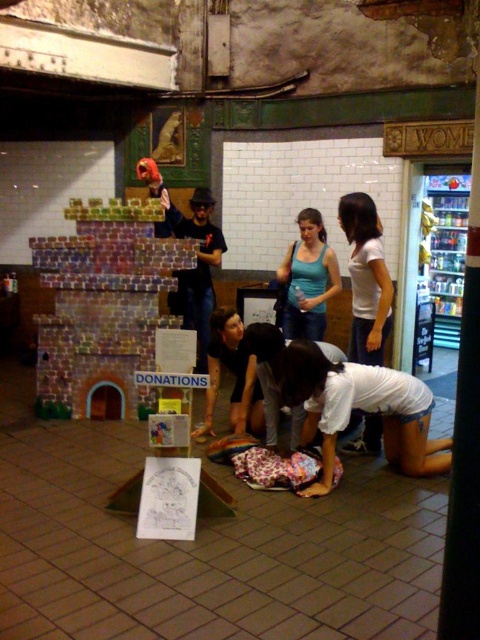
Question: Is multicolored cardboard castle at left in front of matte blue tank top at center?

Choices:
 (A) no
 (B) yes

Answer: (B)

Question: Which point appears farthest from the camera in this image?

Choices:
 (A) (381, 426)
 (B) (285, 305)

Answer: (B)

Question: Can you confirm if multicolored cardboard castle at left is positioned below white matte shirt at center?

Choices:
 (A) yes
 (B) no

Answer: (A)

Question: Does white matte shirt at center have a smaller size compared to matte blue tank top at center?

Choices:
 (A) yes
 (B) no

Answer: (B)

Question: Considering the real-world distances, which object is farthest from the white matte shirt at center?

Choices:
 (A) matte blue tank top at center
 (B) multicolored cardboard castle at left

Answer: (B)

Question: Which object is closer to the camera taking this photo?

Choices:
 (A) matte blue tank top at center
 (B) white matte shirt at center
 (C) multicolored cardboard castle at left

Answer: (B)